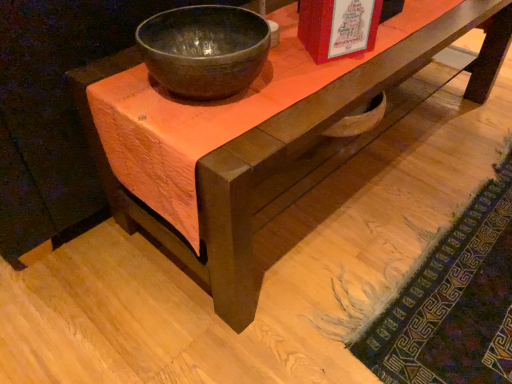
Where is `vacant area that is situated to the right of matte red book at upper center`? This screenshot has height=384, width=512. vacant area that is situated to the right of matte red book at upper center is located at coordinates (397, 42).